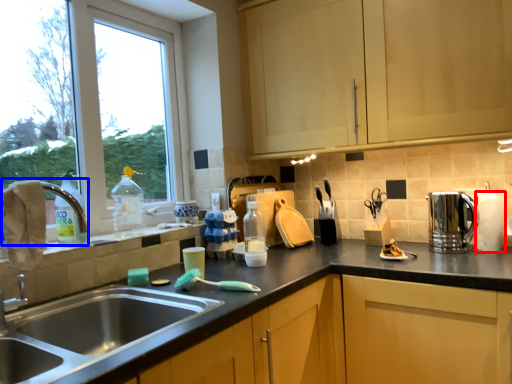
Question: Among these objects, which one is farthest to the camera, paper towel (highlighted by a red box) or faucet (highlighted by a blue box)?

Choices:
 (A) paper towel
 (B) faucet

Answer: (A)